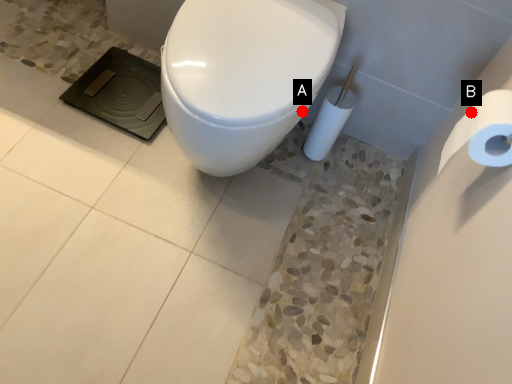
Question: Two points are circled on the image, labeled by A and B beside each circle. Which point is farther from the camera taking this photo?

Choices:
 (A) A is further
 (B) B is further

Answer: (A)